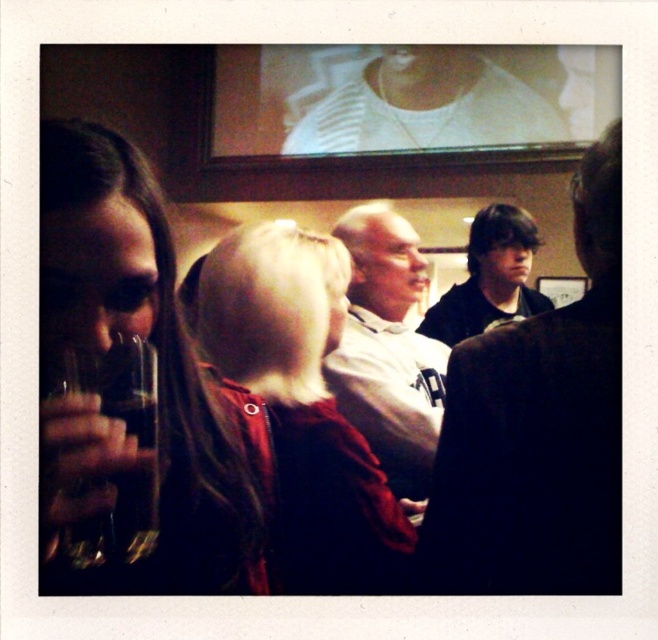
Question: Does velvet red coat at center appear on the right side of translucent glass beverage at lower left?

Choices:
 (A) yes
 (B) no

Answer: (A)

Question: Is velvet red coat at center closer to camera compared to dark brown hair at center?

Choices:
 (A) yes
 (B) no

Answer: (A)

Question: Can you confirm if velvet red coat at center is positioned to the right of translucent glass beverage at lower left?

Choices:
 (A) no
 (B) yes

Answer: (B)

Question: Estimate the real-world distances between objects in this image. Which object is farther from the dark brown hair at center?

Choices:
 (A) velvet red coat at center
 (B) dark blue shirt at right

Answer: (B)

Question: Estimate the real-world distances between objects in this image. Which object is farther from the dark blue shirt at right?

Choices:
 (A) matte black hair at left
 (B) white matte shirt at center
 (C) velvet red coat at center
 (D) translucent glass beverage at lower left

Answer: (B)

Question: Which point appears closest to the camera in this image?

Choices:
 (A) (474, 541)
 (B) (330, 426)

Answer: (A)